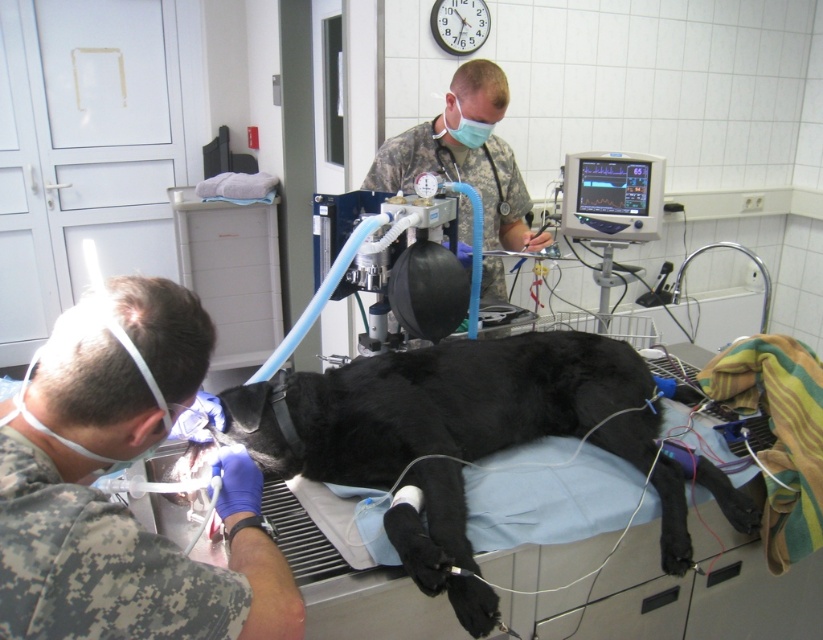
Is the camouflage uniform at center located in the top half of the image?

The camouflage uniform at center is located at point 0.244 on the vertical axis, which is in the bottom half of the image since 0.244 is less than 0.5. Therefore, the answer is no.

Where is the black fur dog at center located in the image?

The black fur dog at center is located at point 0.683 on the x axis and 0.558 on the y axis.